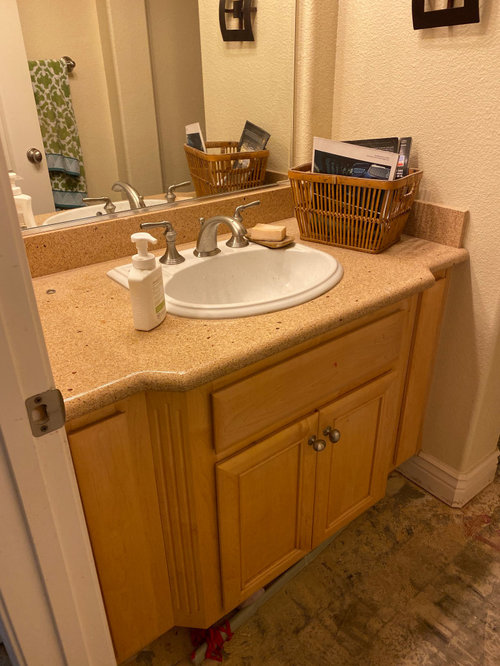
Identify the location of soap bar. (266, 232).